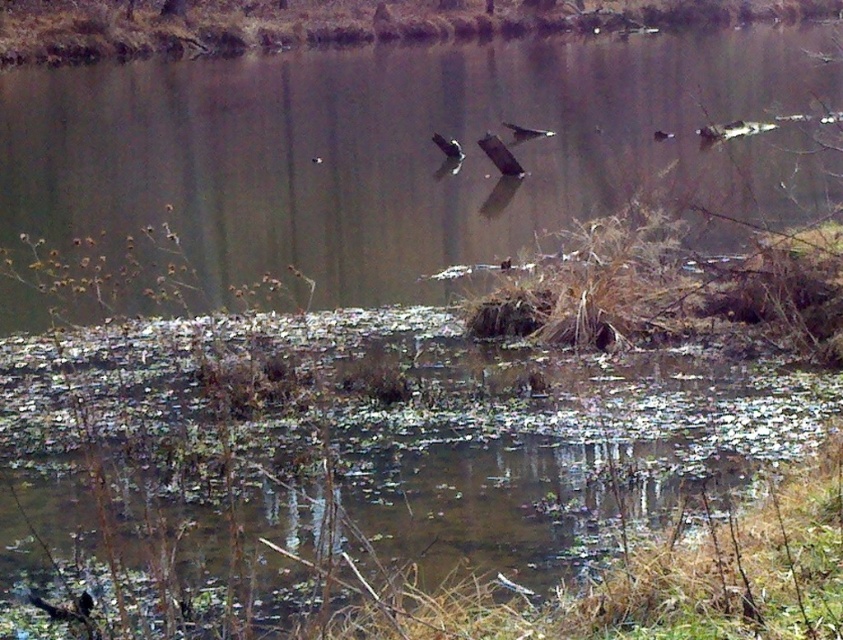
Can you confirm if white glossy bird at center is bigger than brown feathered bird at right?

Correct, white glossy bird at center is larger in size than brown feathered bird at right.

Is point (443, 141) more distant than point (713, 134)?

No, (443, 141) is closer to viewer.

The width and height of the screenshot is (843, 640). What are the coordinates of `white glossy bird at center` in the screenshot? It's located at (448, 154).

Does brown feathered bird at right appear on the left side of shiny black bird at center?

Incorrect, brown feathered bird at right is not on the left side of shiny black bird at center.

Can you confirm if brown feathered bird at right is positioned to the right of shiny black bird at center?

Yes, brown feathered bird at right is to the right of shiny black bird at center.

Who is more forward, (726, 129) or (518, 125)?

Point (726, 129)

The width and height of the screenshot is (843, 640). Find the location of `brown feathered bird at right`. brown feathered bird at right is located at coordinates (723, 131).

Who is more distant from viewer, (x=739, y=122) or (x=663, y=138)?

The point (x=663, y=138) is behind.

Looking at this image, who is shorter, brown feathered bird at right or dark brown feathered bird at upper right?

dark brown feathered bird at upper right

Where is `brown feathered bird at right`? The width and height of the screenshot is (843, 640). brown feathered bird at right is located at coordinates (723, 131).

This screenshot has width=843, height=640. In order to click on brown feathered bird at right in this screenshot , I will do `click(723, 131)`.